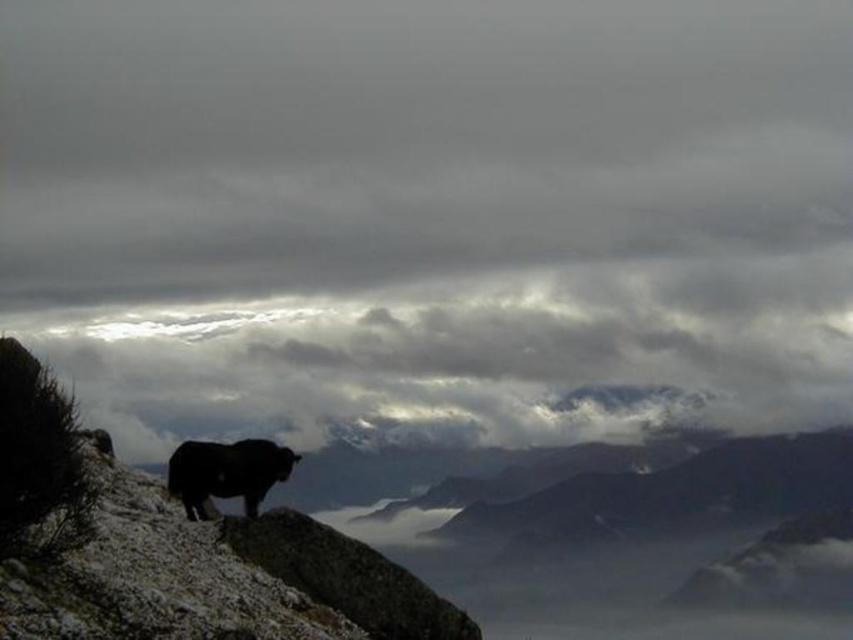
Is the position of cloudy gray sky at upper center less distant than that of black fur at center?

That is True.

Does point (113, 253) lie in front of point (167, 461)?

No, (113, 253) is behind (167, 461).

Find the location of a particular element. cloudy gray sky at upper center is located at coordinates tap(428, 211).